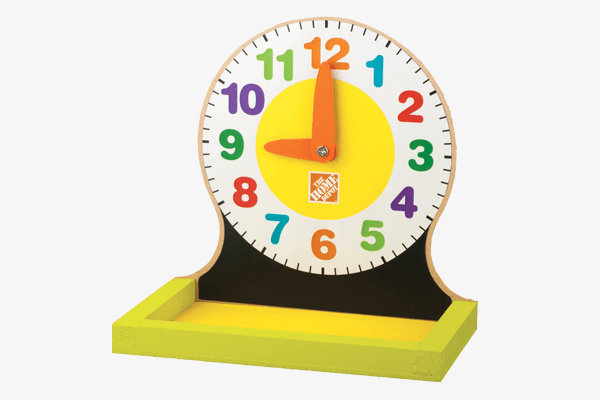
You are a GUI agent. You are given a task and a screenshot of the screen. Output one action in this format:
    pyautogui.click(x=<x>, y=<y>)
    Task: Click on the yellow circle on clock face
    
    Given the screenshot: What is the action you would take?
    pyautogui.click(x=286, y=123)